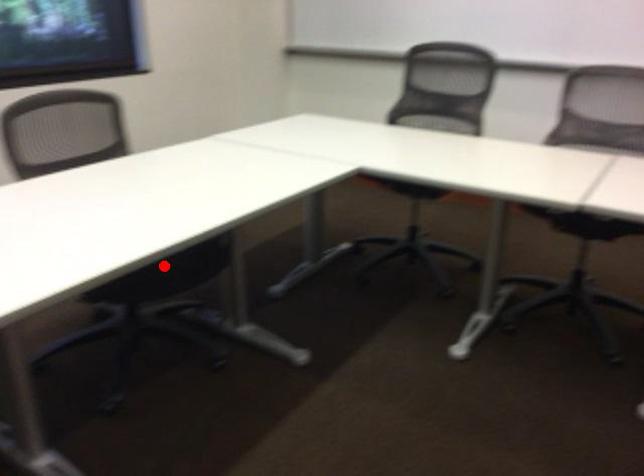
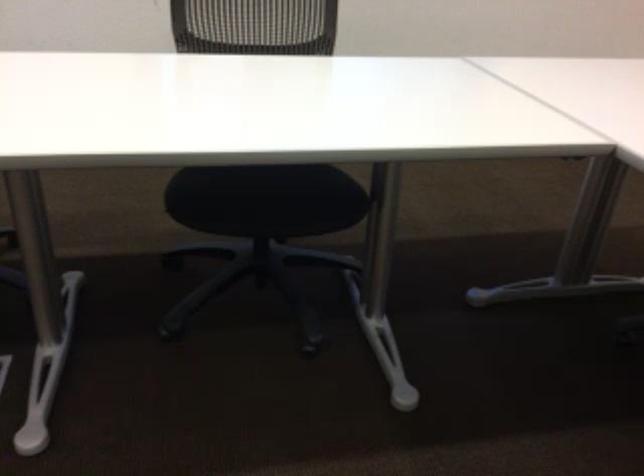
Locate, in the second image, the point that corresponds to the highlighted location in the first image.

(266, 199)